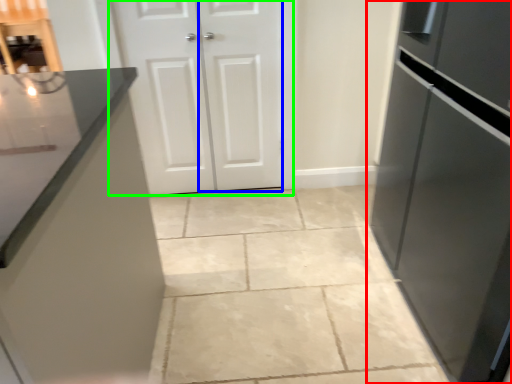
Question: Which is farther away from refrigerator (highlighted by a red box)? door (highlighted by a blue box) or door (highlighted by a green box)?

Choices:
 (A) door
 (B) door

Answer: (B)